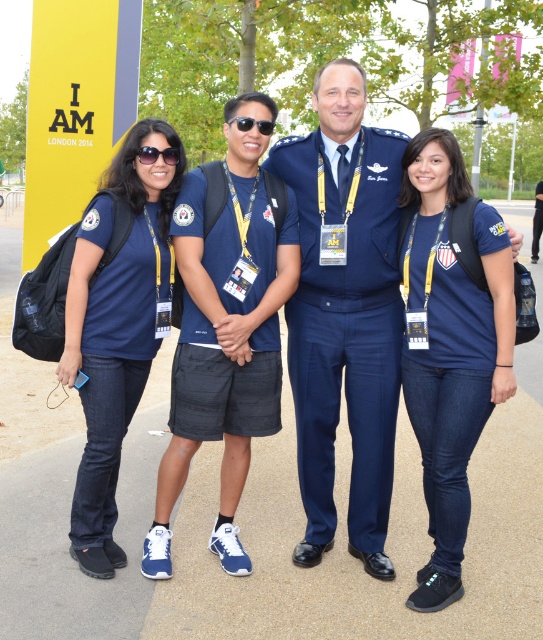
Based on the photo, between matte blue shirt at left and sunglasses at center, which one has more height?

matte blue shirt at left

Does matte blue shirt at left appear on the right side of sunglasses at center?

In fact, matte blue shirt at left is to the left of sunglasses at center.

Which is behind, point (110, 516) or point (266, 124)?

Positioned behind is point (110, 516).

You are a GUI agent. You are given a task and a screenshot of the screen. Output one action in this format:
    pyautogui.click(x=<x>, y=<y>)
    Task: Click on the matte blue shirt at left
    The height and width of the screenshot is (640, 543).
    Given the screenshot: What is the action you would take?
    pyautogui.click(x=116, y=330)

Locate an element on the screen. This screenshot has width=543, height=640. matte black sunglasses at center is located at coordinates (157, 154).

Which of these two, matte black sunglasses at center or sunglasses at center, stands shorter?

sunglasses at center

Is point (157, 152) farther from camera compared to point (243, 131)?

No, it is in front of (243, 131).

Identify the location of matte black sunglasses at center. The image size is (543, 640). (157, 154).

Between matte blue uniform at center and sunglasses at center, which one appears on the right side from the viewer's perspective?

sunglasses at center

Which is behind, point (279, 241) or point (256, 124)?

The point (279, 241) is more distant.

The image size is (543, 640). In order to click on matte blue uniform at center in this screenshot , I will do pos(224,340).